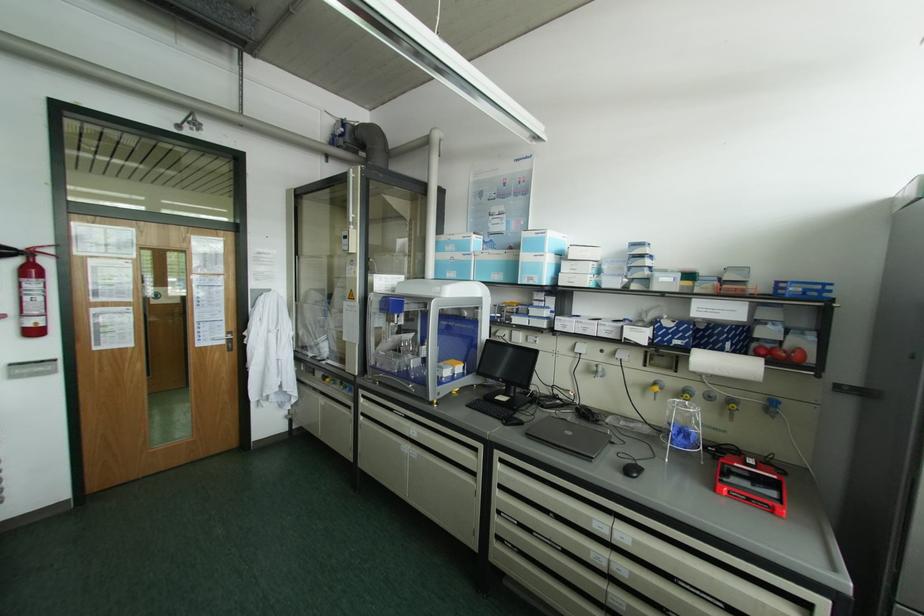
Locate an element on the screen. Image resolution: width=924 pixels, height=616 pixels. blue valve handle is located at coordinates (772, 407).